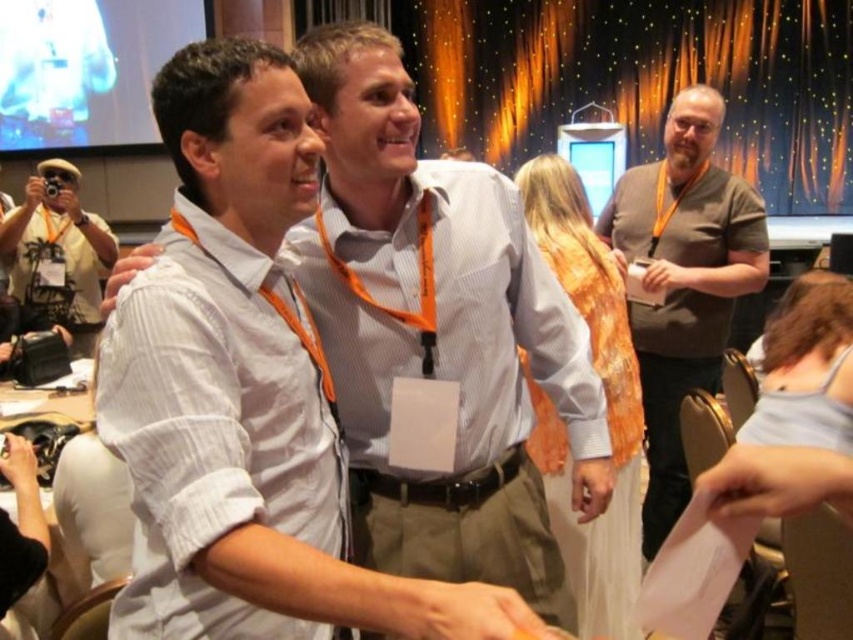
You are standing at the back of the room and want to take a photo of both point (532, 276) and point (103, 252) in the image. Which point will appear larger in your photo?

Point (532, 276) is closer to the camera than point (103, 252), so it will appear larger in the photo.

You are a photographer at the event and need to capture a clear photo of the matte gray shirt at center. The matte black camera at left has a maximum focus range of 3 meters. Can you take the photo without moving the camera or the shirt?

The matte gray shirt at center is 2.85 meters from the matte black camera at left. Since the camera can focus up to 3 meters, you can take the photo without moving either object.

You are a photographer at the event and need to capture a photo of the white shirt at center without the matte black camera at left appearing in the frame. Is this possible based on their positions?

The white shirt at center is located below the matte black camera at left, so adjusting the camera angle downward would allow capturing the white shirt at center without the matte black camera at left obstructing the view.